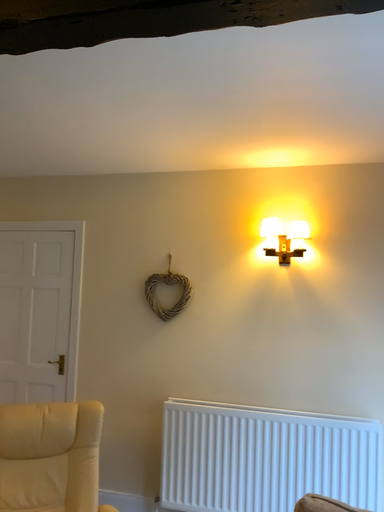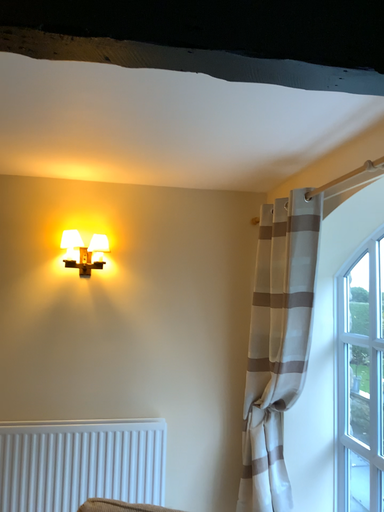
Question: Which way did the camera rotate in the video?

Choices:
 (A) rotated right
 (B) rotated left

Answer: (A)